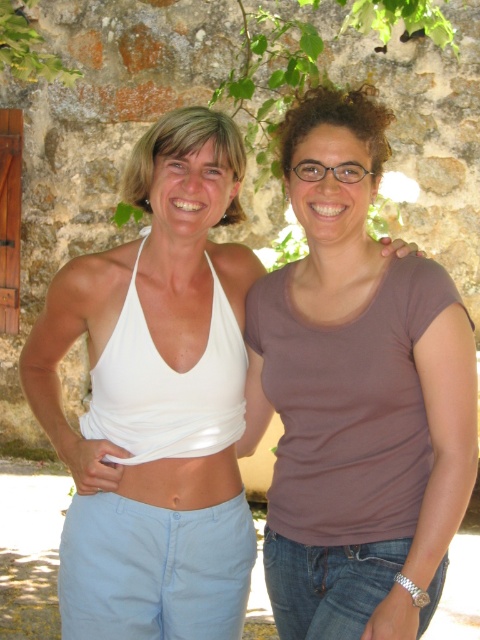
This screenshot has width=480, height=640. Describe the element at coordinates (357, 396) in the screenshot. I see `brown matte shirt at center` at that location.

Is point (274, 566) less distant than point (195, 508)?

No.

At what (x,y) coordinates should I click in order to perform the action: click on brown matte shirt at center. Please return your answer as a coordinate pair (x, y). The height and width of the screenshot is (640, 480). Looking at the image, I should click on (357, 396).

Does point (204, 134) come behind point (99, 401)?

No, it is in front of (99, 401).

Does white fabric top at center appear under white matte bikini top at left?

Yes, white fabric top at center is below white matte bikini top at left.

You are a GUI agent. You are given a task and a screenshot of the screen. Output one action in this format:
    pyautogui.click(x=<x>, y=<y>)
    Task: Click on the white fabric top at center
    This screenshot has height=640, width=480.
    Given the screenshot: What is the action you would take?
    pyautogui.click(x=153, y=305)

Does brown matte shirt at center have a smaller size compared to matte brown hair at upper center?

Actually, brown matte shirt at center might be larger than matte brown hair at upper center.

Looking at this image, measure the distance between brown matte shirt at center and matte brown hair at upper center.

brown matte shirt at center is 38.35 inches from matte brown hair at upper center.

Where is `brown matte shirt at center`? brown matte shirt at center is located at coordinates (357, 396).